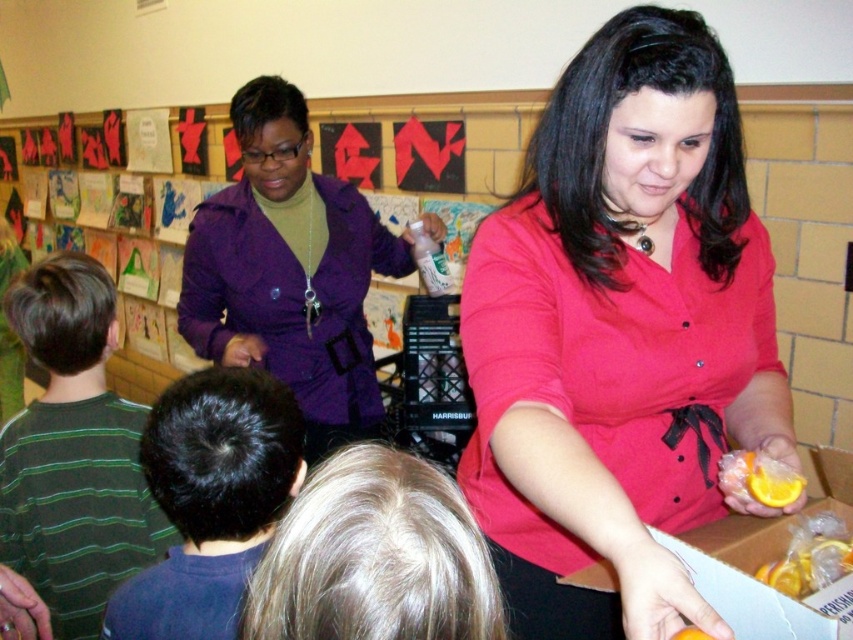
Question: Which point appears farthest from the camera in this image?

Choices:
 (A) (256, 225)
 (B) (790, 596)
 (C) (479, 608)
 (D) (138, 481)

Answer: (A)

Question: Which point appears closest to the camera in this image?

Choices:
 (A) click(44, 561)
 (B) click(618, 560)
 (C) click(370, 524)
 (D) click(822, 600)

Answer: (C)

Question: Does matte red blouse at center have a smaller size compared to translucent plastic orange at lower right?

Choices:
 (A) no
 (B) yes

Answer: (A)

Question: Is purple matte jacket at upper left wider than dark brown hair at back?

Choices:
 (A) yes
 (B) no

Answer: (A)

Question: Which object is positioned closest to the green striped shirt at lower left?

Choices:
 (A) white cardboard box at lower right
 (B) dark brown hair at back
 (C) translucent plastic orange at lower right
 (D) purple matte jacket at upper left

Answer: (B)

Question: Does purple matte jacket at upper left lie behind green striped shirt at lower left?

Choices:
 (A) yes
 (B) no

Answer: (A)